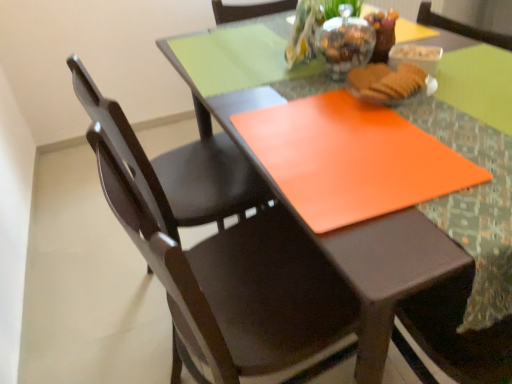
Where is `vacant area that lies between orange matte placemat at center and matte brown biscuit at center`? This screenshot has width=512, height=384. vacant area that lies between orange matte placemat at center and matte brown biscuit at center is located at coordinates (442, 129).